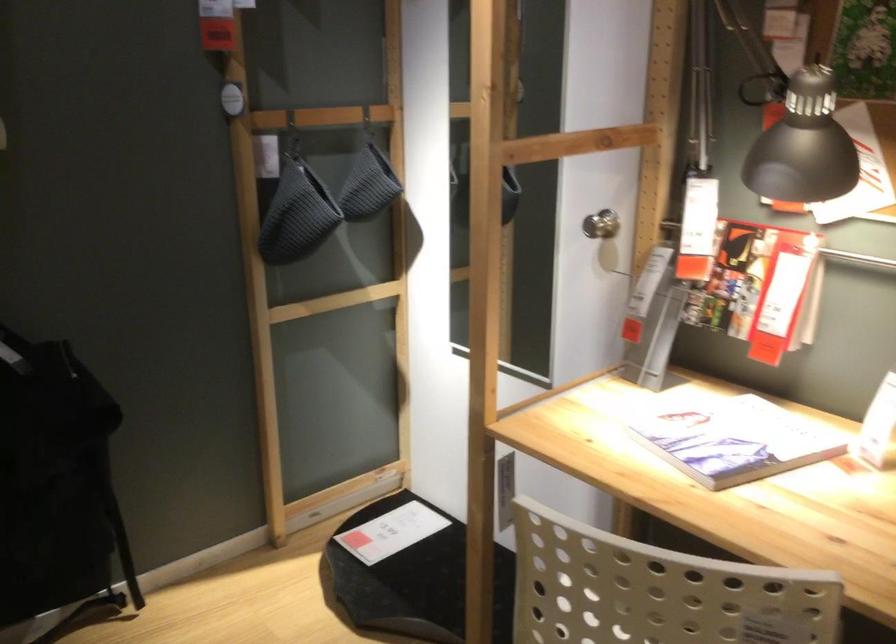
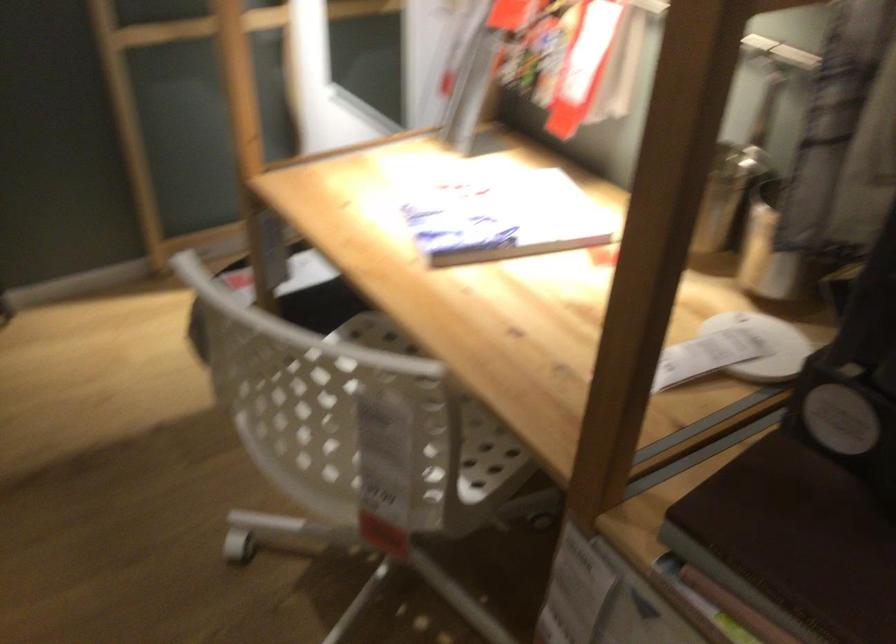
Question: The images are taken continuously from a first-person perspective. In which direction is your viewpoint rotating?

Choices:
 (A) Left
 (B) Right
 (C) Up
 (D) Down

Answer: (D)